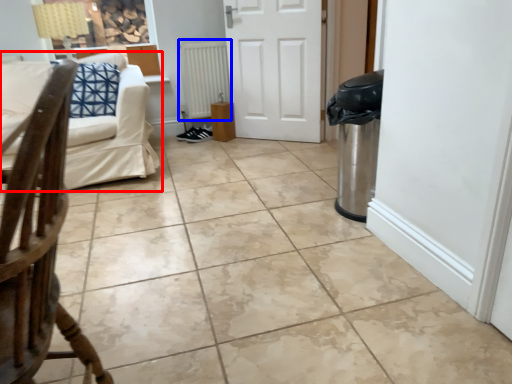
Question: Which object appears farthest to the camera in this image, studio couch (highlighted by a red box) or radiator (highlighted by a blue box)?

Choices:
 (A) studio couch
 (B) radiator

Answer: (B)